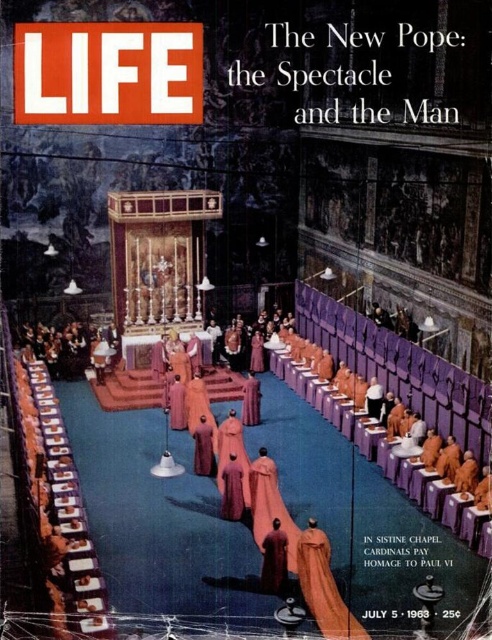
You are a photographer standing in the Sistine Chapel and want to capture a closeup of the velvet robe at center for a magazine cover. The camera you are using has a minimum focusing distance of 1.5 meters. Can you take the photo without moving closer?

The velvet robe at center is 20.32 meters from camera, which is much farther than the camera minimum focusing distance of 1.5 meters. Yes, you can take the photo without moving closer.

You are a photographer standing at the entrance of the Sistine Chapel. You see the velvet maroon robe at center and the velvet robe at center in the scene. Can you fit both subjects into a single photo without moving your position?

The distance between the velvet maroon robe at center and the velvet robe at center is 2.94 meters. Since both subjects are positioned at the center of the scene, they are likely close enough to be captured in a single photo without needing to move your position.